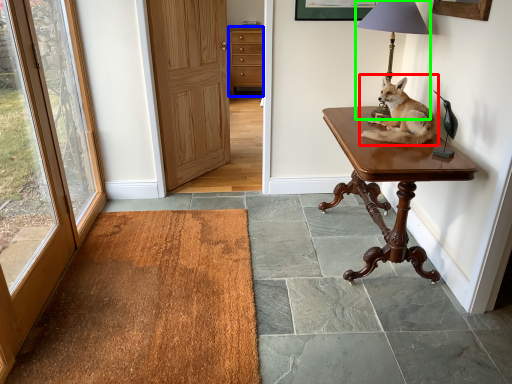
Question: Estimate the real-world distances between objects in this image. Which object is farther from dog (highlighted by a red box), cabinetry (highlighted by a blue box) or lamp (highlighted by a green box)?

Choices:
 (A) cabinetry
 (B) lamp

Answer: (A)